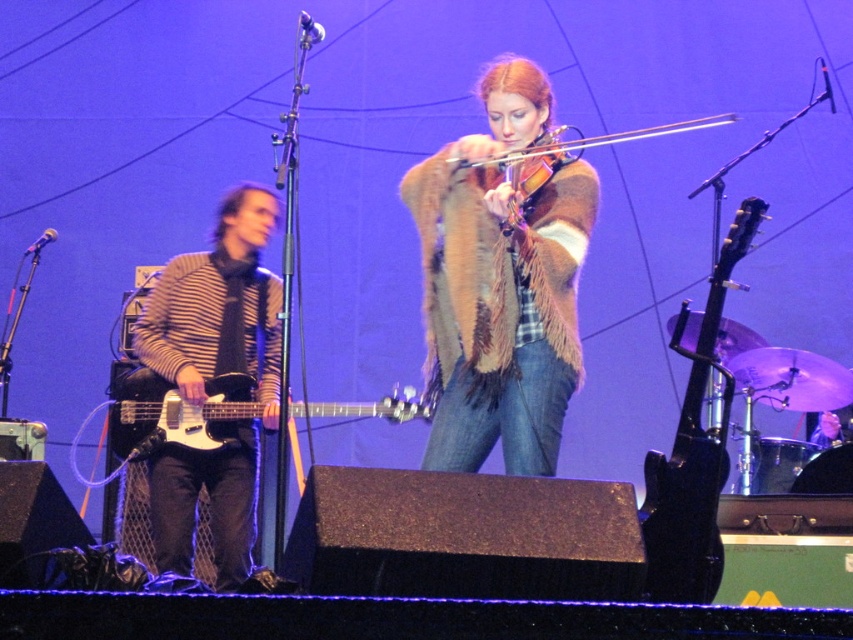
Consider the image. Who is more forward, (242, 524) or (717, 120)?

Positioned in front is point (242, 524).

Can you confirm if striped knit sweater at left is bigger than fur-like violin at center?

Indeed, striped knit sweater at left has a larger size compared to fur-like violin at center.

Between point (160, 336) and point (631, 134), which one is positioned behind?

The point (631, 134) is behind.

This screenshot has width=853, height=640. Identify the location of striped knit sweater at left. (219, 308).

Can you confirm if fuzzy brown fur coat at center is bigger than black glossy electric guitar at center?

Incorrect, fuzzy brown fur coat at center is not larger than black glossy electric guitar at center.

Is fuzzy brown fur coat at center above black glossy electric guitar at center?

Yes.

Where is `fuzzy brown fur coat at center`? The width and height of the screenshot is (853, 640). fuzzy brown fur coat at center is located at coordinates (496, 262).

Where is `fuzzy brown fur coat at center`? fuzzy brown fur coat at center is located at coordinates (496, 262).

Is black glossy electric guitar at right in front of fur-like violin at center?

That is True.

Does black glossy electric guitar at right have a greater height compared to fur-like violin at center?

Indeed, black glossy electric guitar at right has a greater height compared to fur-like violin at center.

Where is `black glossy electric guitar at right`? Image resolution: width=853 pixels, height=640 pixels. black glossy electric guitar at right is located at coordinates (694, 451).